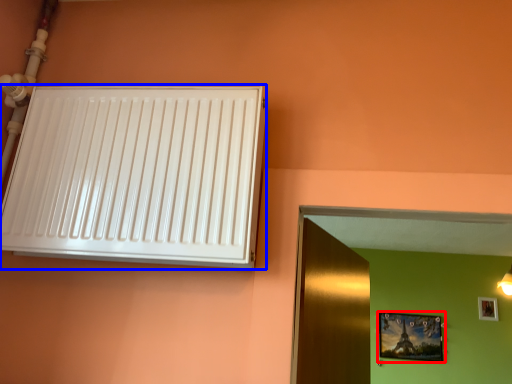
Question: Which point is further to the camera, picture frame (highlighted by a red box) or air conditioning (highlighted by a blue box)?

Choices:
 (A) picture frame
 (B) air conditioning

Answer: (A)